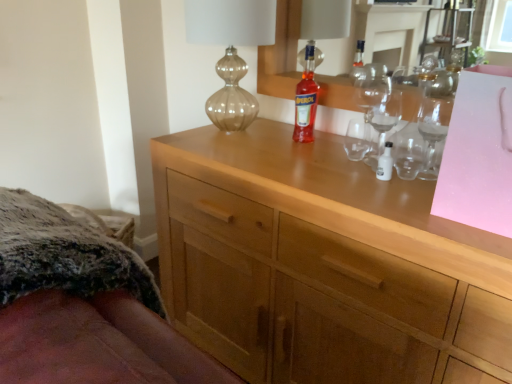
This screenshot has height=384, width=512. I want to click on free space behind translucent glass bottle at center, so click(295, 137).